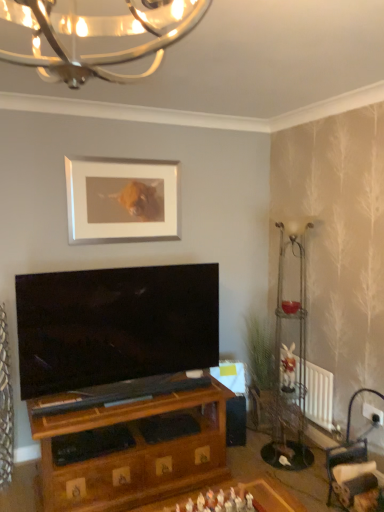
Question: Can you confirm if white radiator at lower right is wider than metallic wire floor lamp at right?

Choices:
 (A) yes
 (B) no

Answer: (B)

Question: From the image's perspective, is white radiator at lower right on metallic wire floor lamp at right?

Choices:
 (A) no
 (B) yes

Answer: (A)

Question: Considering the relative sizes of white radiator at lower right and metallic wire floor lamp at right in the image provided, is white radiator at lower right taller than metallic wire floor lamp at right?

Choices:
 (A) yes
 (B) no

Answer: (B)

Question: From the image's perspective, is white radiator at lower right located beneath metallic wire floor lamp at right?

Choices:
 (A) yes
 (B) no

Answer: (A)

Question: Considering the relative sizes of white radiator at lower right and metallic wire floor lamp at right in the image provided, is white radiator at lower right smaller than metallic wire floor lamp at right?

Choices:
 (A) yes
 (B) no

Answer: (A)

Question: Would you say white radiator at lower right is outside metallic wire floor lamp at right?

Choices:
 (A) no
 (B) yes

Answer: (B)

Question: From the image's perspective, is white radiator at lower right beneath white matte picture frame at upper center?

Choices:
 (A) yes
 (B) no

Answer: (A)

Question: Can you confirm if white radiator at lower right is taller than white matte picture frame at upper center?

Choices:
 (A) yes
 (B) no

Answer: (B)

Question: Are white radiator at lower right and white matte picture frame at upper center located far from each other?

Choices:
 (A) no
 (B) yes

Answer: (B)

Question: Is white radiator at lower right wider than white matte picture frame at upper center?

Choices:
 (A) no
 (B) yes

Answer: (B)

Question: From a real-world perspective, is white radiator at lower right below white matte picture frame at upper center?

Choices:
 (A) yes
 (B) no

Answer: (A)

Question: Considering the relative sizes of white radiator at lower right and white matte picture frame at upper center in the image provided, is white radiator at lower right bigger than white matte picture frame at upper center?

Choices:
 (A) no
 (B) yes

Answer: (A)

Question: Is metallic wire floor lamp at right smaller than white matte picture frame at upper center?

Choices:
 (A) yes
 (B) no

Answer: (B)